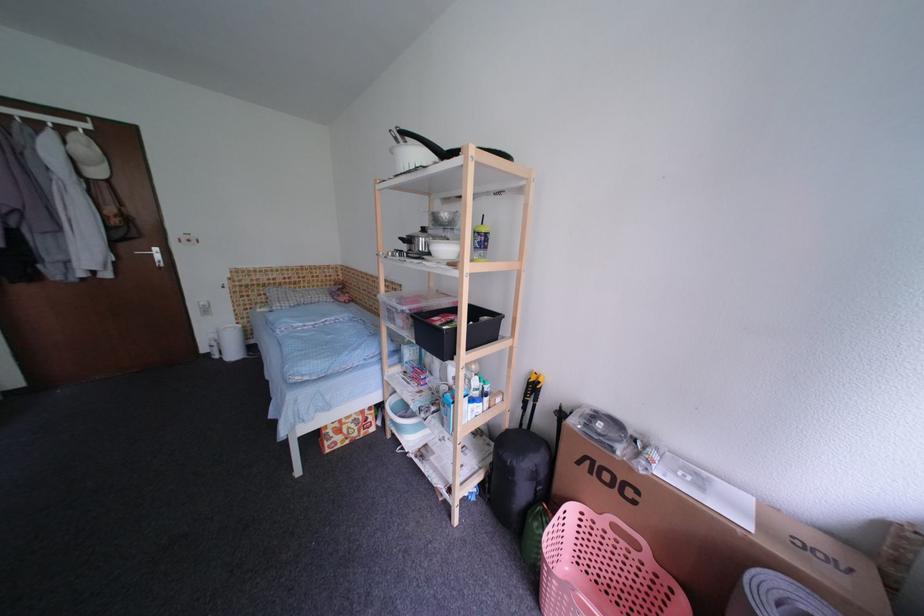
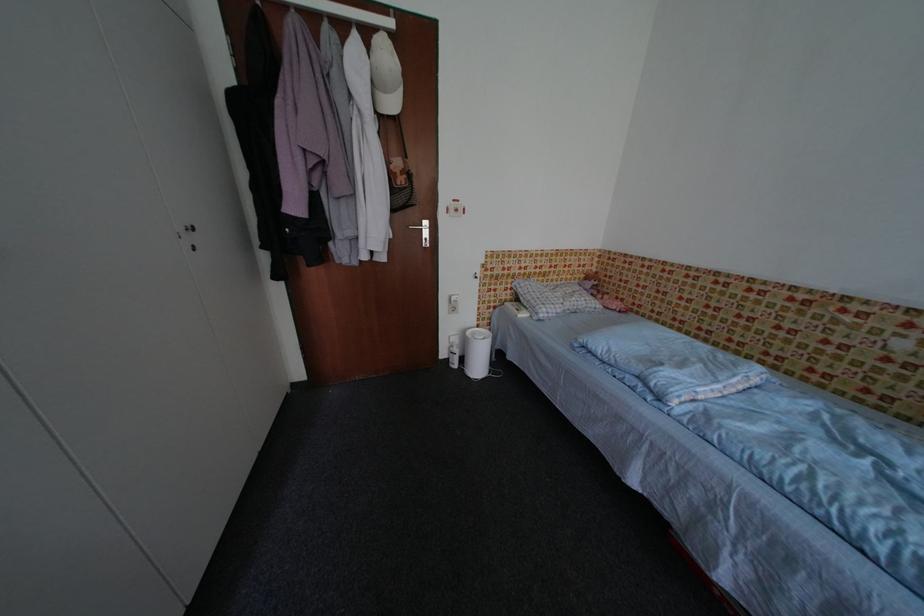
In the second image, find the point that corresponds to point (105, 175) in the first image.

(400, 107)